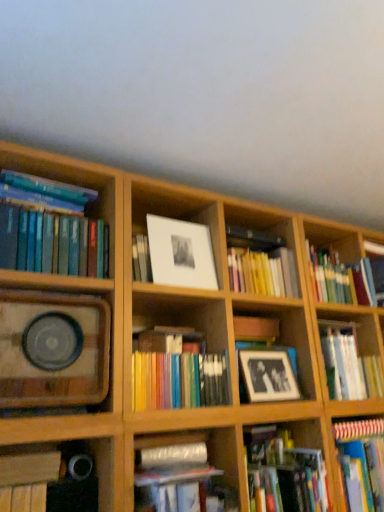
The height and width of the screenshot is (512, 384). Find the location of `wooden speaker at left, marked as the 2th shelf in a right-to-left arrangement`. wooden speaker at left, marked as the 2th shelf in a right-to-left arrangement is located at coordinates (53, 349).

The image size is (384, 512). I want to click on black matte picture frame at center, the 2th picture frame when ordered from top to bottom, so click(268, 375).

This screenshot has width=384, height=512. What are the coordinates of `yellow matte book at center, which is counted as the 3th book, starting from the right` in the screenshot? It's located at (260, 263).

Describe the element at coordinates (283, 473) in the screenshot. I see `hardcover book at lower right, marked as the second book in a right-to-left arrangement` at that location.

The width and height of the screenshot is (384, 512). In order to click on hardcover book at lower right, marked as the second book in a right-to-left arrangement in this screenshot , I will do `click(283, 473)`.

Describe the element at coordinates (283, 336) in the screenshot. This screenshot has width=384, height=512. I see `matte black frame at center, the second shelf viewed from the left` at that location.

The width and height of the screenshot is (384, 512). Describe the element at coordinates (50, 228) in the screenshot. I see `teal hardcover book at left, the eighth book positioned from the right` at that location.

Where is `wooden speaker at left, marked as the 2th shelf in a right-to-left arrangement`? Image resolution: width=384 pixels, height=512 pixels. wooden speaker at left, marked as the 2th shelf in a right-to-left arrangement is located at coordinates (53, 349).

In the image, is yellow matte book at center, which is counted as the 6th book, starting from the left, positioned in front of or behind hardcover book at lower right, acting as the seventh book starting from the left?

Clearly, yellow matte book at center, which is counted as the 6th book, starting from the left, is behind hardcover book at lower right, acting as the seventh book starting from the left.

Is yellow matte book at center, which is counted as the 3th book, starting from the right, wider or thinner than hardcover book at lower right, marked as the second book in a right-to-left arrangement?

In the image, yellow matte book at center, which is counted as the 3th book, starting from the right, appears to be wider than hardcover book at lower right, marked as the second book in a right-to-left arrangement.

Which is in front, point (257, 267) or point (247, 444)?

The point (247, 444) is in front.

Which of these two, wooden speaker at left, the first shelf positioned from the left, or black matte picture frame at center, the 2th picture frame when ordered from top to bottom, stands shorter?

black matte picture frame at center, the 2th picture frame when ordered from top to bottom.

Is wooden speaker at left, the first shelf positioned from the left, in contact with black matte picture frame at center, the second picture frame positioned from the left?

No, wooden speaker at left, the first shelf positioned from the left, is not beside black matte picture frame at center, the second picture frame positioned from the left.

Is wooden speaker at left, marked as the 2th shelf in a right-to-left arrangement, oriented towards black matte picture frame at center, the 1th picture frame in the bottom-to-top sequence?

No.

Based on their positions, is hardcover book at lower right, acting as the seventh book starting from the left, located to the left or right of wooden speaker at left, marked as the 2th shelf in a right-to-left arrangement?

From the image, it's evident that hardcover book at lower right, acting as the seventh book starting from the left, is to the right of wooden speaker at left, marked as the 2th shelf in a right-to-left arrangement.

Considering the sizes of objects hardcover book at lower right, marked as the second book in a right-to-left arrangement, and wooden speaker at left, the first shelf positioned from the left, in the image provided, who is bigger, hardcover book at lower right, marked as the second book in a right-to-left arrangement, or wooden speaker at left, the first shelf positioned from the left,?

With larger size is wooden speaker at left, the first shelf positioned from the left.

Are hardcover book at lower right, acting as the seventh book starting from the left, and wooden speaker at left, marked as the 2th shelf in a right-to-left arrangement, located far from each other?

hardcover book at lower right, acting as the seventh book starting from the left, is actually quite close to wooden speaker at left, marked as the 2th shelf in a right-to-left arrangement.

Is wooden speaker at left, marked as the 2th shelf in a right-to-left arrangement, turned away from teal hardcover book at left, the eighth book positioned from the right?

No, wooden speaker at left, marked as the 2th shelf in a right-to-left arrangement,'s orientation is not away from teal hardcover book at left, the eighth book positioned from the right.

From the image's perspective, is wooden speaker at left, marked as the 2th shelf in a right-to-left arrangement, on top of teal hardcover book at left, the eighth book positioned from the right?

No.

Between wooden speaker at left, marked as the 2th shelf in a right-to-left arrangement, and teal hardcover book at left, acting as the first book starting from the left, which one appears on the right side from the viewer's perspective?

wooden speaker at left, marked as the 2th shelf in a right-to-left arrangement, is more to the right.

Is wooden speaker at left, the first shelf positioned from the left, taller than teal hardcover book at left, the eighth book positioned from the right?

Indeed, wooden speaker at left, the first shelf positioned from the left, has a greater height compared to teal hardcover book at left, the eighth book positioned from the right.

From the image's perspective, is white matte picture frame at center, the second picture frame when ordered from right to left, below wooden book at lower left, positioned as the 7th book in right-to-left order?

No, from the image's perspective, white matte picture frame at center, the second picture frame when ordered from right to left, is not beneath wooden book at lower left, positioned as the 7th book in right-to-left order.

Can you confirm if white matte picture frame at center, the first picture frame viewed from the left, is shorter than wooden book at lower left, positioned as the 7th book in right-to-left order?

No, white matte picture frame at center, the first picture frame viewed from the left, is not shorter than wooden book at lower left, positioned as the 7th book in right-to-left order.

Between white matte picture frame at center, which appears as the second picture frame when ordered from the bottom, and wooden book at lower left, positioned as the 7th book in right-to-left order, which one appears on the right side from the viewer's perspective?

white matte picture frame at center, which appears as the second picture frame when ordered from the bottom.

Can you confirm if wooden speaker at left, the first shelf positioned from the left, is thinner than white matte photo frame at center, which is the 8th book from left to right?

No.

Can you confirm if wooden speaker at left, marked as the 2th shelf in a right-to-left arrangement, is taller than white matte photo frame at center, the first book when ordered from right to left?

Yes.

From the image's perspective, is wooden speaker at left, marked as the 2th shelf in a right-to-left arrangement, under white matte photo frame at center, which is the 8th book from left to right?

No, from the image's perspective, wooden speaker at left, marked as the 2th shelf in a right-to-left arrangement, is not below white matte photo frame at center, which is the 8th book from left to right.

Is wooden speaker at left, marked as the 2th shelf in a right-to-left arrangement, positioned far away from white matte photo frame at center, the first book when ordered from right to left?

wooden speaker at left, marked as the 2th shelf in a right-to-left arrangement, is far away from white matte photo frame at center, the first book when ordered from right to left.

Between yellow matte book at center, which is counted as the 6th book, starting from the left, and wooden book at lower left, positioned as the 7th book in right-to-left order, which one is positioned behind?

yellow matte book at center, which is counted as the 6th book, starting from the left, is behind.

Is yellow matte book at center, which is counted as the 6th book, starting from the left, far from wooden book at lower left, positioned as the 7th book in right-to-left order?

yellow matte book at center, which is counted as the 6th book, starting from the left, is actually quite close to wooden book at lower left, positioned as the 7th book in right-to-left order.

Choose the correct answer: Is yellow matte book at center, which is counted as the 6th book, starting from the left, inside wooden book at lower left, acting as the second book starting from the left, or outside it?

yellow matte book at center, which is counted as the 6th book, starting from the left, exists outside the volume of wooden book at lower left, acting as the second book starting from the left.

Starting from the hardcover book at lower right, marked as the second book in a right-to-left arrangement, which book is the 1st one behind? Please provide its 2D coordinates.

[(260, 263)]

Locate an element on the screen. The width and height of the screenshot is (384, 512). shelf that is the 2nd object to the left of the black matte picture frame at center, the 2th picture frame when ordered from top to bottom, starting at the anchor is located at coordinates (53, 349).

Which object lies further to the anchor point wooden book at lower left, positioned as the 7th book in right-to-left order, hardcover book at lower right, acting as the seventh book starting from the left, or metallic silver tape at lower center, the fifth book positioned from the left?

hardcover book at lower right, acting as the seventh book starting from the left, lies further to wooden book at lower left, positioned as the 7th book in right-to-left order, than the other object.

From the image, which object appears to be nearer to teal hardcover book at left, acting as the first book starting from the left, wooden speaker at left, marked as the 2th shelf in a right-to-left arrangement, or white matte picture frame at center, which appears as the second picture frame when ordered from the bottom?

The object closer to teal hardcover book at left, acting as the first book starting from the left, is wooden speaker at left, marked as the 2th shelf in a right-to-left arrangement.

Based on their spatial positions, is metallic silver tape at lower center, the fourth book positioned from the right, or wooden book at lower left, acting as the second book starting from the left, closer to hardcover book at lower right, acting as the seventh book starting from the left?

metallic silver tape at lower center, the fourth book positioned from the right.

Looking at the image, which one is located further to matte black frame at center, the second shelf viewed from the left, metallic silver tape at lower center, the fifth book positioned from the left, or teal hardcover book at left, the eighth book positioned from the right?

The object further to matte black frame at center, the second shelf viewed from the left, is teal hardcover book at left, the eighth book positioned from the right.

Consider the image. Considering their positions, is multicolored paperbacks at center, the fourth book viewed from the left, positioned closer to wooden speaker at left, the first shelf positioned from the left, than hardcover book at lower right, acting as the seventh book starting from the left?

multicolored paperbacks at center, the fourth book viewed from the left, is closer to wooden speaker at left, the first shelf positioned from the left.

Which object lies further to the anchor point yellow matte book at center, which is counted as the 6th book, starting from the left, black matte picture frame at center, arranged as the 1th picture frame when viewed from the right, or matte black frame at center, the first shelf positioned from the right?

black matte picture frame at center, arranged as the 1th picture frame when viewed from the right, is further to yellow matte book at center, which is counted as the 6th book, starting from the left.

Consider the image. From the image, which object appears to be farther from hardcover book at lower right, acting as the seventh book starting from the left, multicolored paperbacks at center, the fourth book viewed from the left, or yellow matte book at center, which is counted as the 6th book, starting from the left?

yellow matte book at center, which is counted as the 6th book, starting from the left.

Looking at the image, which one is located closer to hardcover book at lower right, acting as the seventh book starting from the left, black matte book at lower left, the 3th book positioned from the left, or metallic silver tape at lower center, the fourth book positioned from the right?

metallic silver tape at lower center, the fourth book positioned from the right, is closer to hardcover book at lower right, acting as the seventh book starting from the left.

Where is `picture frame between white matte picture frame at center, the second picture frame when ordered from right to left, and white matte photo frame at center, which is the 8th book from left to right`? picture frame between white matte picture frame at center, the second picture frame when ordered from right to left, and white matte photo frame at center, which is the 8th book from left to right is located at coordinates (268, 375).

The image size is (384, 512). Identify the location of shelf situated between wooden book at lower left, acting as the second book starting from the left, and metallic silver tape at lower center, the fourth book positioned from the right, from left to right. (53, 349).

Find the location of a particular element. The height and width of the screenshot is (512, 384). shelf between multicolored paperbacks at center, which is the fifth book from right to left, and metallic silver tape at lower center, the fifth book positioned from the left, in the up-down direction is located at coordinates (283, 336).

Where is `picture frame between yellow matte book at center, which is counted as the 6th book, starting from the left, and hardcover book at lower right, marked as the second book in a right-to-left arrangement, vertically`? Image resolution: width=384 pixels, height=512 pixels. picture frame between yellow matte book at center, which is counted as the 6th book, starting from the left, and hardcover book at lower right, marked as the second book in a right-to-left arrangement, vertically is located at coordinates (268, 375).